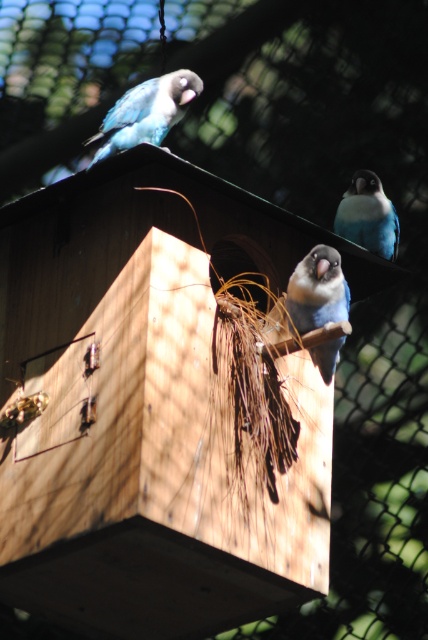
Who is higher up, matte blue parrot at upper left or blue matte parrot at upper right?

matte blue parrot at upper left is higher up.

Who is positioned more to the left, matte blue parrot at upper left or blue matte parrot at upper right?

matte blue parrot at upper left

Does point (142, 99) come closer to viewer compared to point (359, 236)?

Yes, point (142, 99) is closer to viewer.

Identify the location of matte blue parrot at upper left. (145, 113).

Who is more forward, [139,136] or [323,260]?

Point [323,260] is more forward.

Can you confirm if matte blue parrot at upper left is shorter than blue matte parrot at center?

Correct, matte blue parrot at upper left is not as tall as blue matte parrot at center.

Between point (134, 96) and point (303, 317), which one is positioned in front?

Positioned in front is point (303, 317).

The image size is (428, 640). Identify the location of matte blue parrot at upper left. (145, 113).

Can you confirm if blue matte parrot at center is smaller than blue matte parrot at upper right?

Yes, blue matte parrot at center is smaller than blue matte parrot at upper right.

Between blue matte parrot at center and blue matte parrot at upper right, which one appears on the left side from the viewer's perspective?

blue matte parrot at center

Who is more forward, [332,262] or [357,240]?

Point [332,262] is in front.

I want to click on blue matte parrot at center, so click(x=317, y=291).